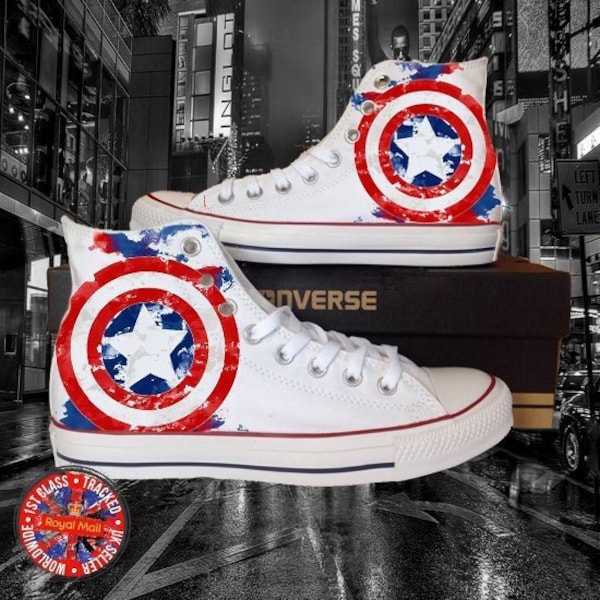
Identify the location of shoe box. This screenshot has height=600, width=600. (398, 297).